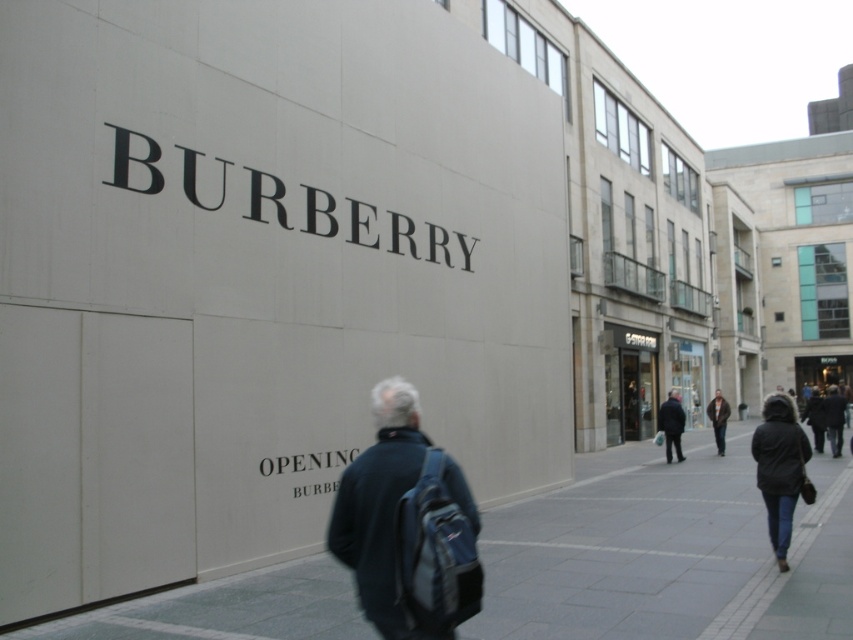
Does point (613, 557) lie in front of point (381, 628)?

No, it is behind (381, 628).

Is gray concrete pavement at lower center closer to the viewer compared to dark blue backpack at center?

No, it is not.

Who is more forward, [781,611] or [396,384]?

Point [781,611] is more forward.

Image resolution: width=853 pixels, height=640 pixels. What are the coordinates of `gray concrete pavement at lower center` in the screenshot? It's located at (666, 552).

Can you confirm if dark blue backpack at center is positioned below dark blue jacket at center?

Actually, dark blue backpack at center is above dark blue jacket at center.

This screenshot has width=853, height=640. Describe the element at coordinates (407, 525) in the screenshot. I see `dark blue backpack at center` at that location.

In order to click on dark blue backpack at center in this screenshot , I will do `click(407, 525)`.

Is point (683, 456) less distant than point (714, 396)?

Yes, it is in front of point (714, 396).

Does dark blue jacket at center appear on the right side of dark brown leather jacket at center?

Incorrect, dark blue jacket at center is not on the right side of dark brown leather jacket at center.

Is point (672, 413) behind point (715, 388)?

No, (672, 413) is in front of (715, 388).

Find the location of a particular element. The image size is (853, 640). dark blue jacket at center is located at coordinates (671, 424).